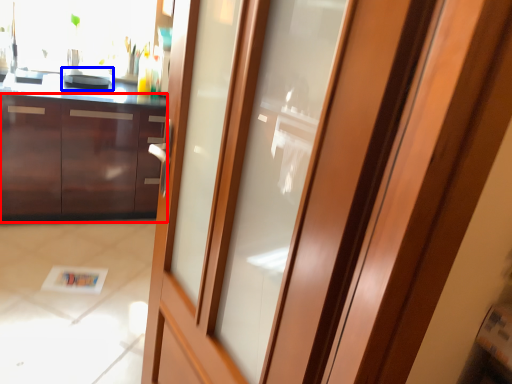
Question: Which of the following is the closest to the observer, cabinetry (highlighted by a red box) or appliance (highlighted by a blue box)?

Choices:
 (A) cabinetry
 (B) appliance

Answer: (A)